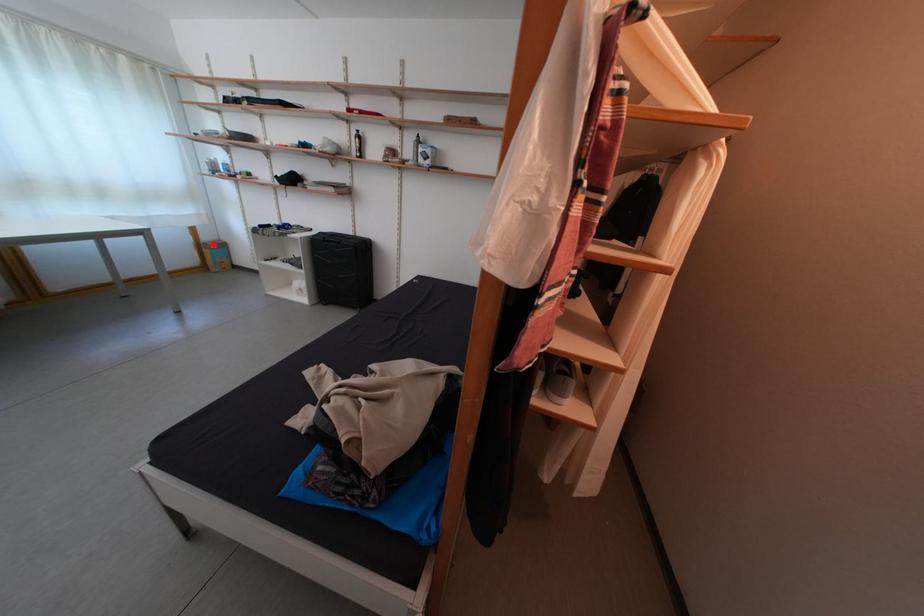
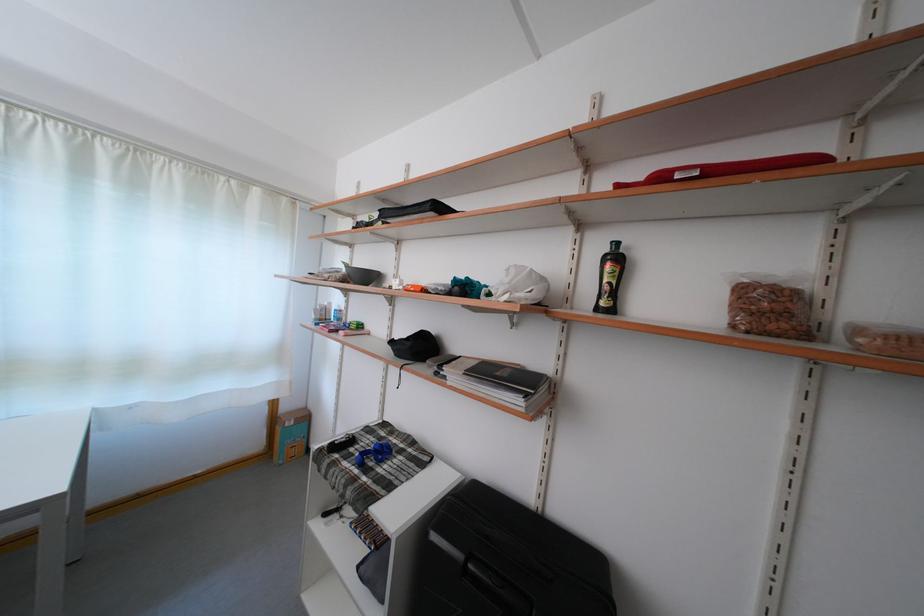
Locate, in the second image, the point that corresponds to the highlighted location in the first image.

(293, 415)